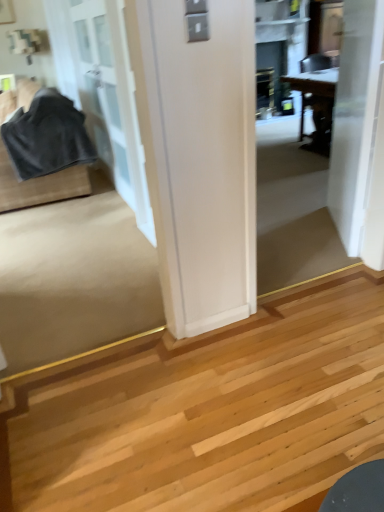
Question: Based on their sizes in the image, would you say white glass door at left, the 2th door when ordered from right to left, is bigger or smaller than velvet-like black fabric at left?

Choices:
 (A) small
 (B) big

Answer: (B)

Question: In the image, is white glass door at left, the 2th door when ordered from right to left, positioned in front of or behind velvet-like black fabric at left?

Choices:
 (A) front
 (B) behind

Answer: (A)

Question: Which of these objects is positioned closest to the velvet-like black fabric at left?

Choices:
 (A) white smooth door at upper right, which ranks as the first door in right-to-left order
 (B) white glass door at left, the 2th door when ordered from right to left

Answer: (B)

Question: Estimate the real-world distances between objects in this image. Which object is closer to the white glass door at left, arranged as the 1th door when viewed from the left?

Choices:
 (A) white smooth door at upper right, which ranks as the second door in left-to-right order
 (B) velvet-like black fabric at left

Answer: (B)